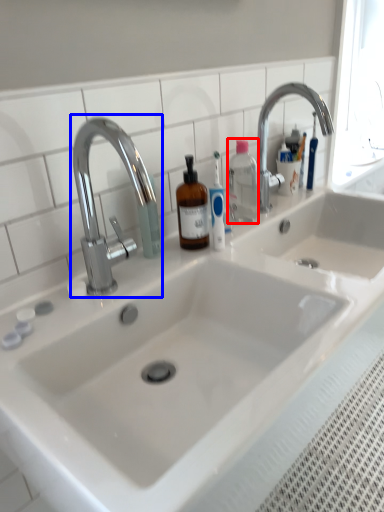
Question: Which of the following is the closest to the observer, bottle (highlighted by a red box) or tap (highlighted by a blue box)?

Choices:
 (A) bottle
 (B) tap

Answer: (B)